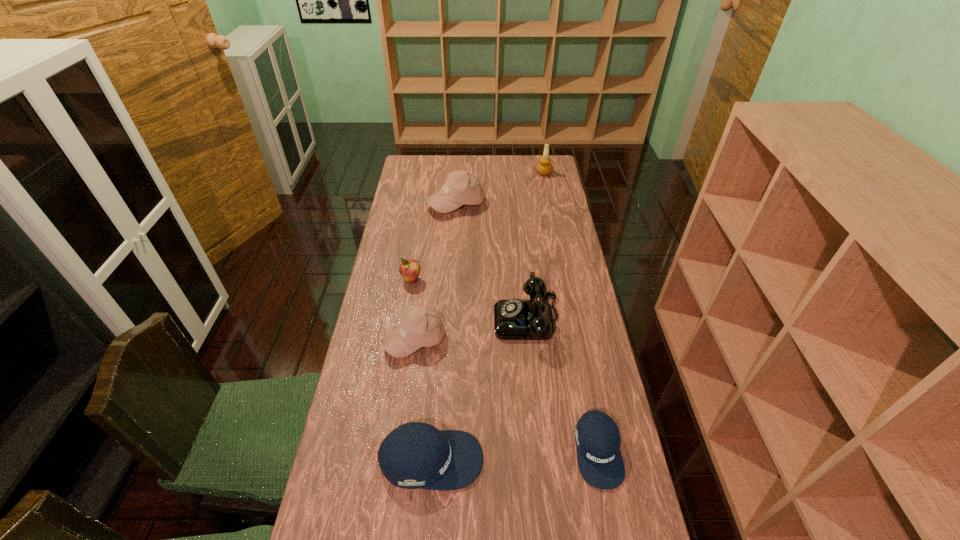
Identify the location of the rightmost baseball cap. (597, 437).

You are a GUI agent. You are given a task and a screenshot of the screen. Output one action in this format:
    pyautogui.click(x=<x>, y=<y>)
    Task: Click on the blank area located 0.230m on the front of the candle_holder
    Image resolution: width=960 pixels, height=540 pixels.
    Given the screenshot: What is the action you would take?
    pyautogui.click(x=550, y=205)

Find the location of a particular element. The image size is (960, 540). vacant region located 0.320m on the front-facing side of the second farthest object is located at coordinates (451, 271).

Image resolution: width=960 pixels, height=540 pixels. Find the location of `vacant space located on the dial of the telephone`. vacant space located on the dial of the telephone is located at coordinates (386, 319).

Find the location of a particular element. vacant space located on the dial of the telephone is located at coordinates (410, 319).

Identify the location of blank space located on the dial of the telephone. (479, 319).

The height and width of the screenshot is (540, 960). I want to click on free space located on the front of the fifth nearest object, so click(x=397, y=368).

Where is `vacant area situated on the front-facing side of the third nearest baseball cap`? vacant area situated on the front-facing side of the third nearest baseball cap is located at coordinates (396, 489).

This screenshot has width=960, height=540. Identify the location of free space located 0.310m on the front-facing side of the left blue baseball cap. [603, 460].

Find the location of a particular element. vacant region located 0.050m on the front-facing side of the right blue baseball cap is located at coordinates (610, 512).